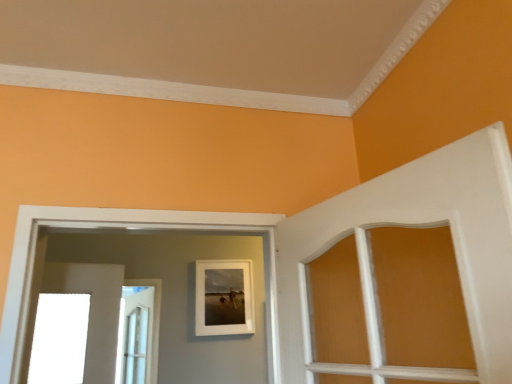
Question: Based on their sizes in the image, would you say white glossy door at left is bigger or smaller than white matte picture frame at center?

Choices:
 (A) big
 (B) small

Answer: (B)

Question: From a real-world perspective, relative to white matte picture frame at center, is white glossy door at left vertically above or below?

Choices:
 (A) below
 (B) above

Answer: (A)

Question: From the image's perspective, is white glossy door at left above or below white matte picture frame at center?

Choices:
 (A) above
 (B) below

Answer: (B)

Question: Considering the positions of white matte picture frame at center and white glossy door at left in the image, is white matte picture frame at center taller or shorter than white glossy door at left?

Choices:
 (A) tall
 (B) short

Answer: (B)

Question: Is white matte picture frame at center bigger or smaller than white glossy door at left?

Choices:
 (A) small
 (B) big

Answer: (B)

Question: Which is correct: white matte picture frame at center is inside white glossy door at left, or outside of it?

Choices:
 (A) outside
 (B) inside

Answer: (A)

Question: Considering the relative positions of white matte picture frame at center and white glossy door at left in the image provided, is white matte picture frame at center to the left or to the right of white glossy door at left?

Choices:
 (A) right
 (B) left

Answer: (A)